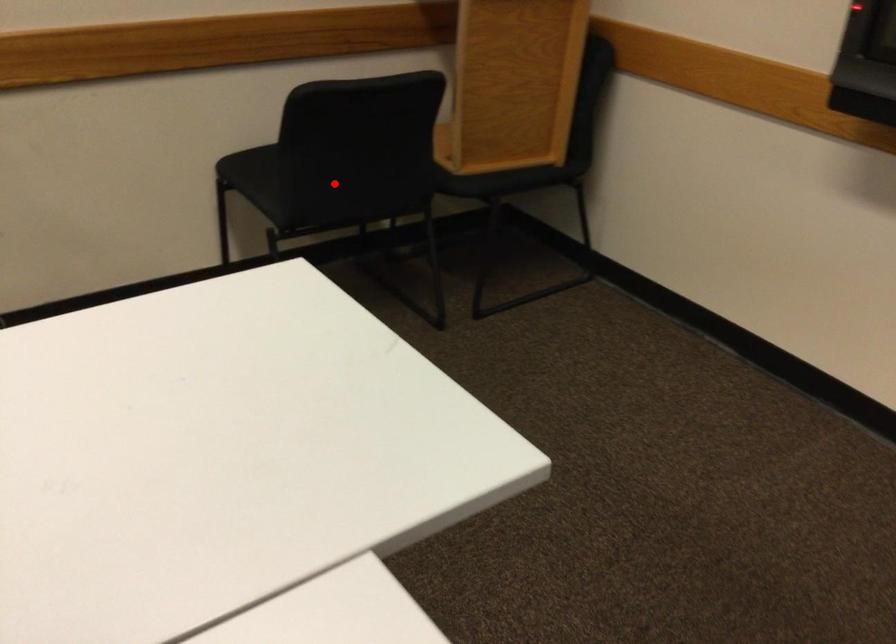
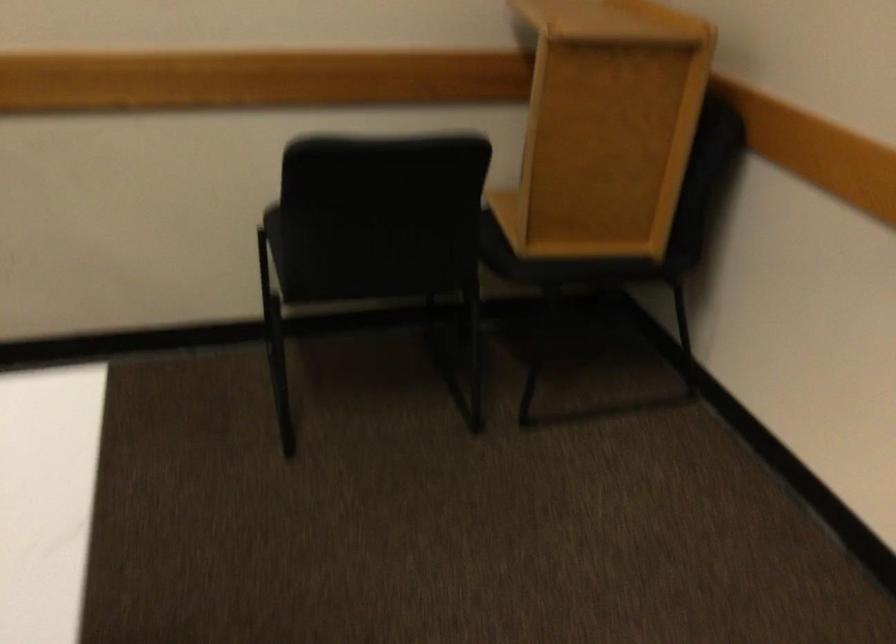
Question: I am providing you with two images of the same scene from different viewpoints. In image1, a red point is highlighted. Considering the same 3D point in image2, which of the following is correct?

Choices:
 (A) It is closer
 (B) It is farther

Answer: (A)